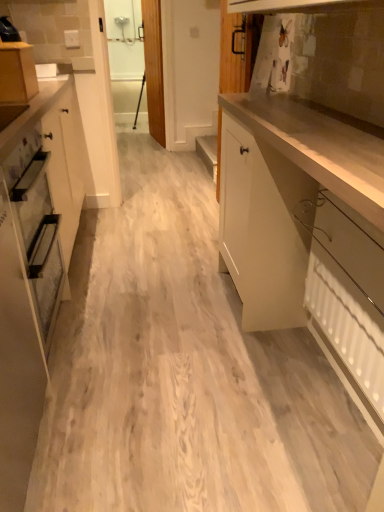
Identify the location of vacant space behind white glossy cabinet at left, the 2th cabinetry positioned from the right. (109, 383).